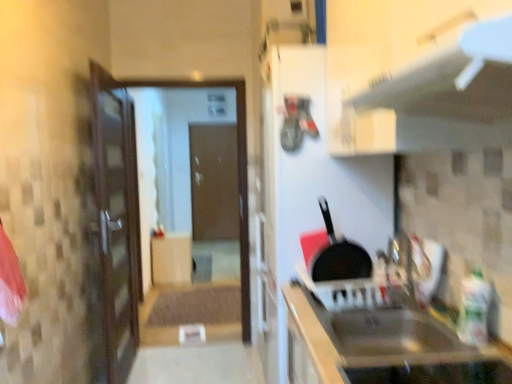
At what (x,y) coordinates should I click in order to perform the action: click on vacant space situated above transparent glass door at center (from a real-world perspective). Please return your answer as a coordinate pair (x, y). Looking at the image, I should click on (176, 71).